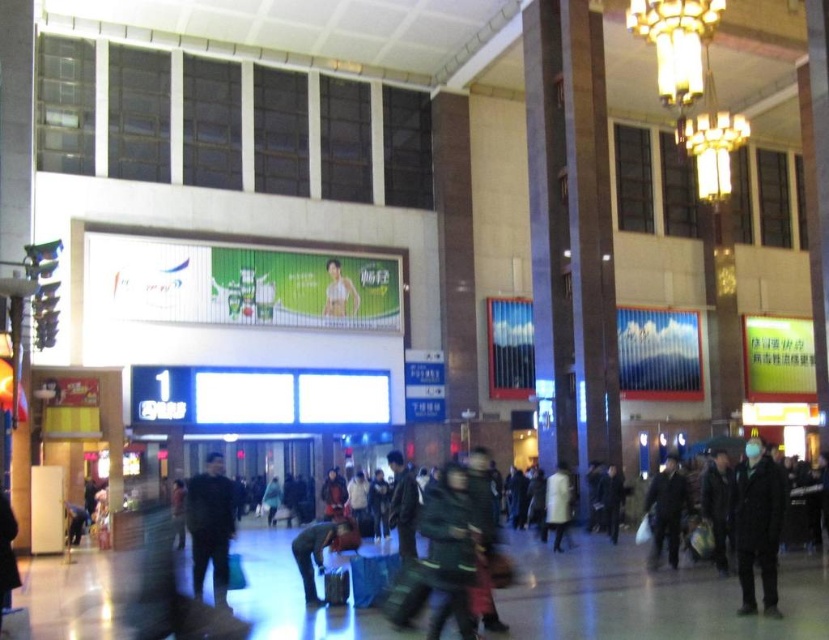
In the scene shown: You are a photographer trying to capture both the dark matte clothing at center and the dark green jacket at center in a single frame. Given that your camera has a limited focus range, which object should you prioritize focusing on to ensure clarity, considering their sizes and positions?

The dark matte clothing at center has a larger size compared to the dark green jacket at center, so focusing on the dark matte clothing at center would ensure clarity due to its larger size occupying more of the frame.

You are standing in the train station and see a point marked at coordinates (211, 525). According to the image, what object is located at this point?

The point at coordinates (211, 525) is located on the dark gray fabric jacket at lower left.

You are standing in the train station and want to take a photo of both the point at coordinates [211,561] and the point at coordinates [672,509]. Which point should you focus on first to ensure both are in focus?

You should focus on the point at coordinates [211,561] first because it is closer to you than the point at coordinates [672,509]. This ensures the closer point is in focus, and the farther point will also be in focus due to depth of field.